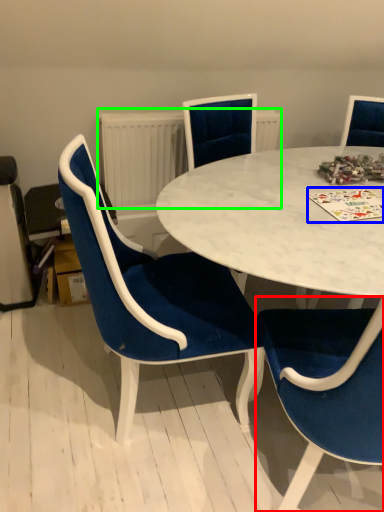
Question: Estimate the real-world distances between objects in this image. Which object is farther from chair (highlighted by a red box), card game (highlighted by a blue box) or radiator (highlighted by a green box)?

Choices:
 (A) card game
 (B) radiator

Answer: (B)